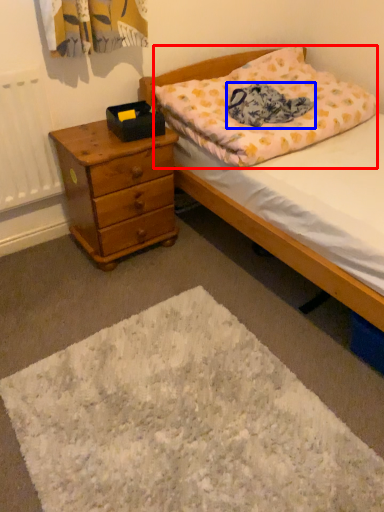
Question: Which object is further to the camera taking this photo, pillow (highlighted by a red box) or blanket (highlighted by a blue box)?

Choices:
 (A) pillow
 (B) blanket

Answer: (B)